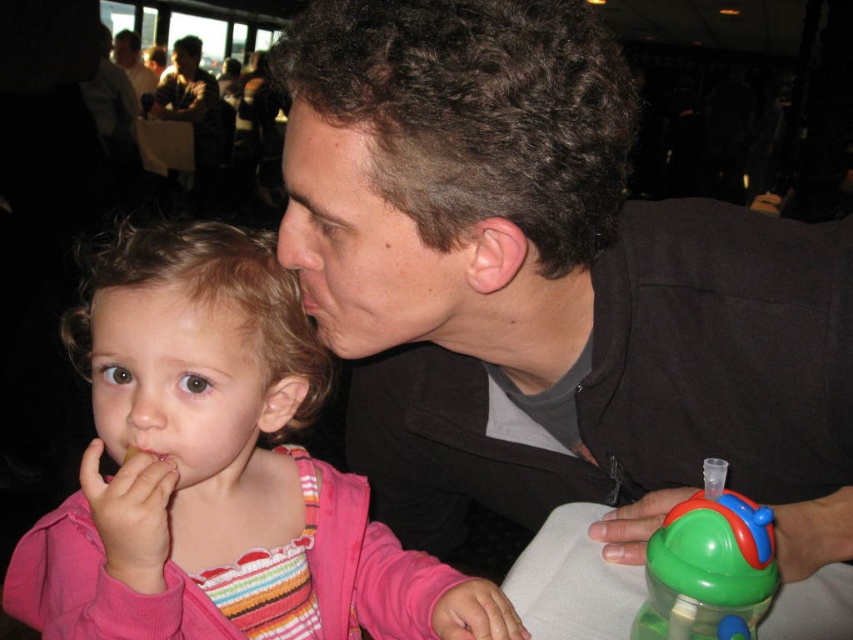
Who is positioned more to the right, pink fleece jacket at left or light brown skin at upper left?

pink fleece jacket at left is more to the right.

Image resolution: width=853 pixels, height=640 pixels. In order to click on pink fleece jacket at left in this screenshot , I will do pos(219,472).

Is point (292, 376) farther from camera compared to point (140, 81)?

No, (292, 376) is closer to viewer.

Which is above, pink fleece jacket at left or matte black shirt at upper left?

matte black shirt at upper left is above.

Between point (171, 445) and point (125, 35), which one is positioned behind?

The point (125, 35) is behind.

This screenshot has height=640, width=853. Identify the location of pink fleece jacket at left. (219, 472).

Is pink fleece jacket at left smaller than green plastic sippy cup at lower right?

No.

Is point (239, 532) in front of point (697, 586)?

That is False.

Where is `pink fleece jacket at left`? This screenshot has height=640, width=853. pink fleece jacket at left is located at coordinates (219, 472).